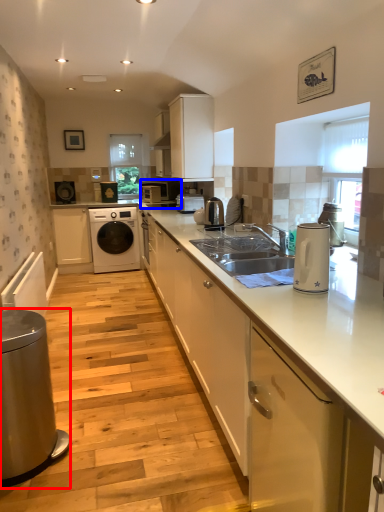
Question: Which object is further to the camera taking this photo, home appliance (highlighted by a red box) or home appliance (highlighted by a blue box)?

Choices:
 (A) home appliance
 (B) home appliance

Answer: (B)